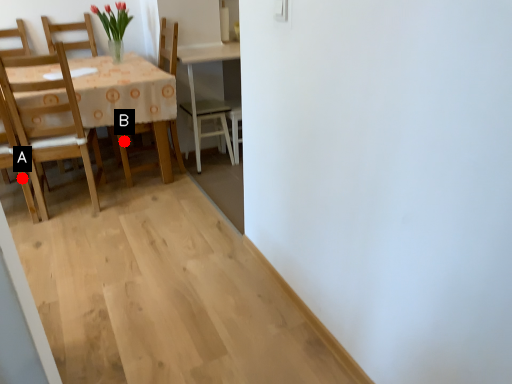
Question: Two points are circled on the image, labeled by A and B beside each circle. Among these points, which one is nearest to the camera?

Choices:
 (A) A is closer
 (B) B is closer

Answer: (A)